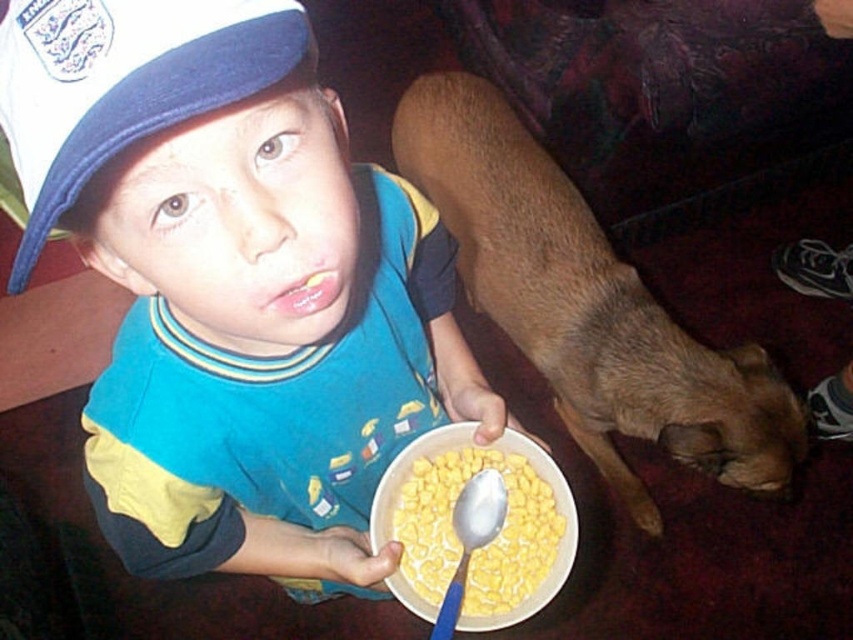
Question: Is brown furry dog at lower right thinner than blue plastic spoon at lower center?

Choices:
 (A) no
 (B) yes

Answer: (A)

Question: Which object is the closest to the blue plastic spoon at lower center?

Choices:
 (A) yellow cornflakes at lower center
 (B) blue fabric baseball cap at upper left

Answer: (A)

Question: Is brown furry dog at lower right thinner than blue fabric baseball cap at upper left?

Choices:
 (A) no
 (B) yes

Answer: (A)

Question: Which point is farther to the camera?

Choices:
 (A) yellow cornflakes at lower center
 (B) blue cotton shirt at center
 (C) blue fabric baseball cap at upper left

Answer: (A)

Question: Estimate the real-world distances between objects in this image. Which object is farther from the blue fabric baseball cap at upper left?

Choices:
 (A) yellow cornflakes at lower center
 (B) blue plastic spoon at lower center
 (C) blue cotton shirt at center

Answer: (A)

Question: Where is blue fabric baseball cap at upper left located in relation to blue plastic spoon at lower center in the image?

Choices:
 (A) above
 (B) below

Answer: (A)